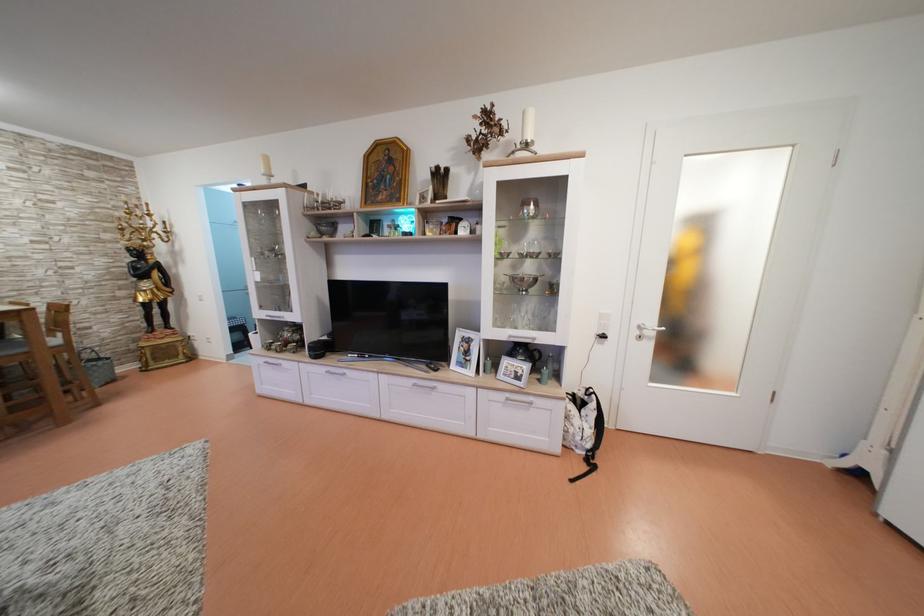
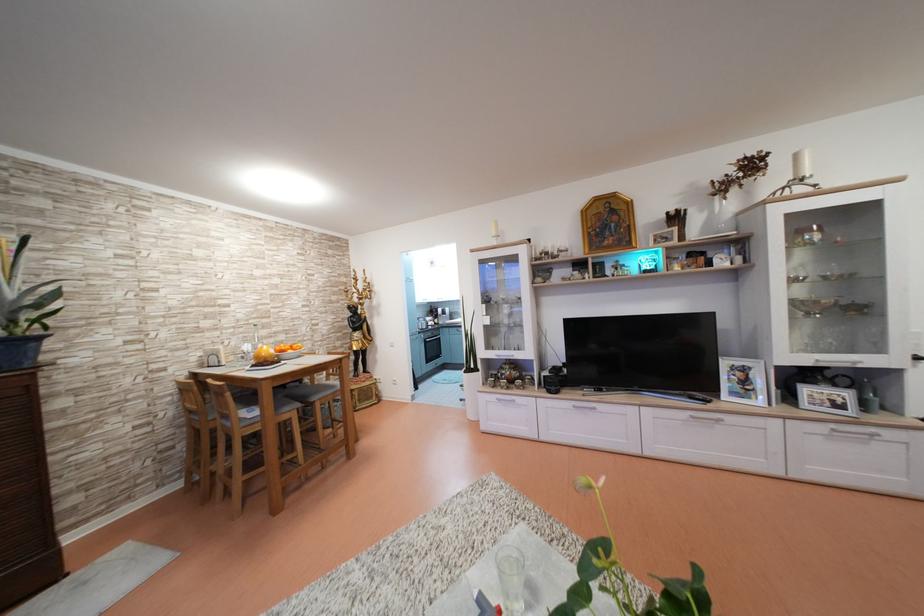
In the second image, find the point that corresponds to pixel 515 400 in the first image.

(840, 431)